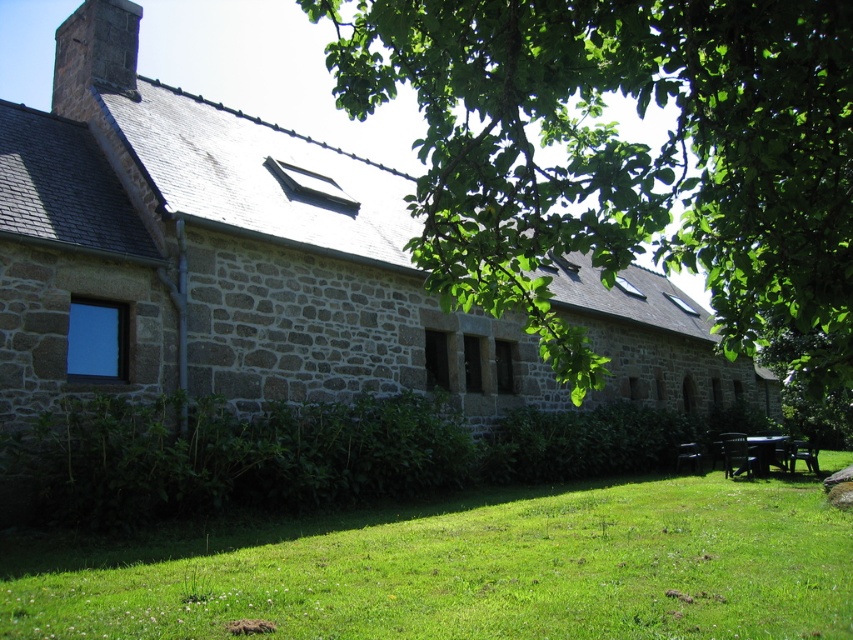
Who is positioned more to the right, green leafy tree at upper center or green grass at lower center?

From the viewer's perspective, green leafy tree at upper center appears more on the right side.

Does green leafy tree at upper center have a greater height compared to green grass at lower center?

Yes.

Find the location of `green leafy tree at upper center`. green leafy tree at upper center is located at coordinates (625, 157).

Which is above, green leafy tree at upper center or black plastic picnic table at lower right?

green leafy tree at upper center

Between green leafy tree at upper center and black plastic picnic table at lower right, which one appears on the left side from the viewer's perspective?

Positioned to the left is green leafy tree at upper center.

Between point (833, 260) and point (763, 467), which one is positioned in front?

Positioned in front is point (833, 260).

This screenshot has height=640, width=853. I want to click on green leafy tree at upper center, so click(625, 157).

Who is positioned more to the left, green grass at lower center or black plastic picnic table at lower right?

From the viewer's perspective, green grass at lower center appears more on the left side.

Consider the image. Is green grass at lower center closer to the viewer compared to black plastic picnic table at lower right?

Yes, it is in front of black plastic picnic table at lower right.

Is point (521, 561) positioned in front of point (753, 444)?

Yes.

This screenshot has height=640, width=853. Find the location of `green grass at lower center`. green grass at lower center is located at coordinates (463, 568).